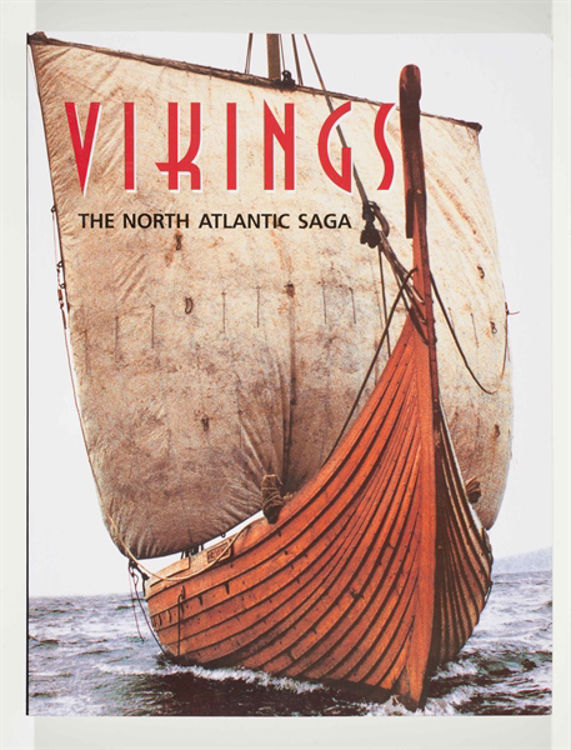
At what (x,y) coordinates should I click in order to perform the action: click on name plate. Please return your answer as a coordinate pair (x, y). Image resolution: width=571 pixels, height=750 pixels. Looking at the image, I should click on (214, 554), (225, 554).